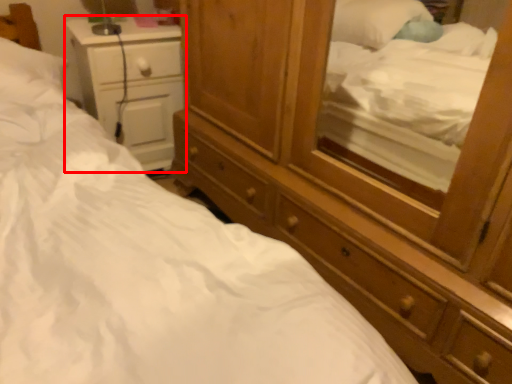
Question: From the image, what is the correct spatial relationship of nightstand (annotated by the red box) in relation to dresser?

Choices:
 (A) right
 (B) left

Answer: (B)